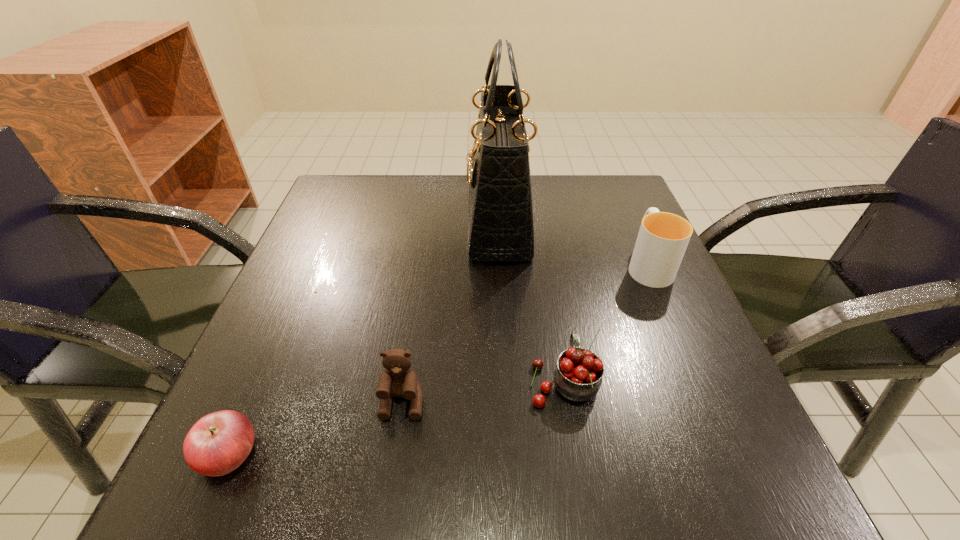
You are a GUI agent. You are given a task and a screenshot of the screen. Output one action in this format:
    pyautogui.click(x=<x>, y=<y>)
    Task: Click on the unoccupied area between the cherry and the tallest object
    The image size is (960, 540).
    Given the screenshot: What is the action you would take?
    pyautogui.click(x=531, y=302)

You are a GUI agent. You are given a task and a screenshot of the screen. Output one action in this format:
    pyautogui.click(x=<x>, y=<y>)
    Task: Click on the unoccupied area between the cup and the tallest object
    The width and height of the screenshot is (960, 540).
    Given the screenshot: What is the action you would take?
    pyautogui.click(x=573, y=244)

Identify the location of vacant point located between the fourth object from right to left and the nearest object. This screenshot has height=540, width=960. (316, 428).

What are the coordinates of `empty location between the cup and the second object from left to right` in the screenshot? It's located at (525, 333).

The image size is (960, 540). Identify the location of free space between the leftmost object and the teddy bear. (x=316, y=428).

Identify the location of free spot between the cherry and the teddy bear. (483, 392).

Identify the location of vacant space in between the shortest object and the teddy bear. (316, 428).

You are a GUI agent. You are given a task and a screenshot of the screen. Output one action in this format:
    pyautogui.click(x=<x>, y=<y>)
    Task: Click on the free space between the tallest object and the shortest object
    
    Given the screenshot: What is the action you would take?
    pyautogui.click(x=364, y=339)

Find the location of a particular element. This screenshot has height=540, width=960. object that is the nearest to the handbag is located at coordinates (663, 237).

Choose which object is the nearest neighbor to the cup. Please provide its 2D coordinates. Your answer should be formatted as a tuple, i.e. [(x, y)], where the tuple contains the x and y coordinates of a point satisfying the conditions above.

[(500, 213)]